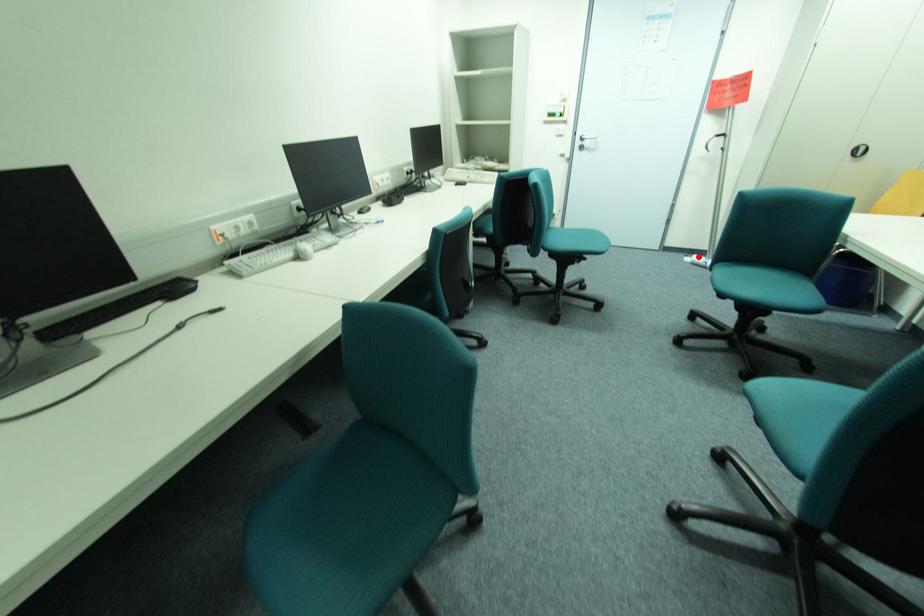
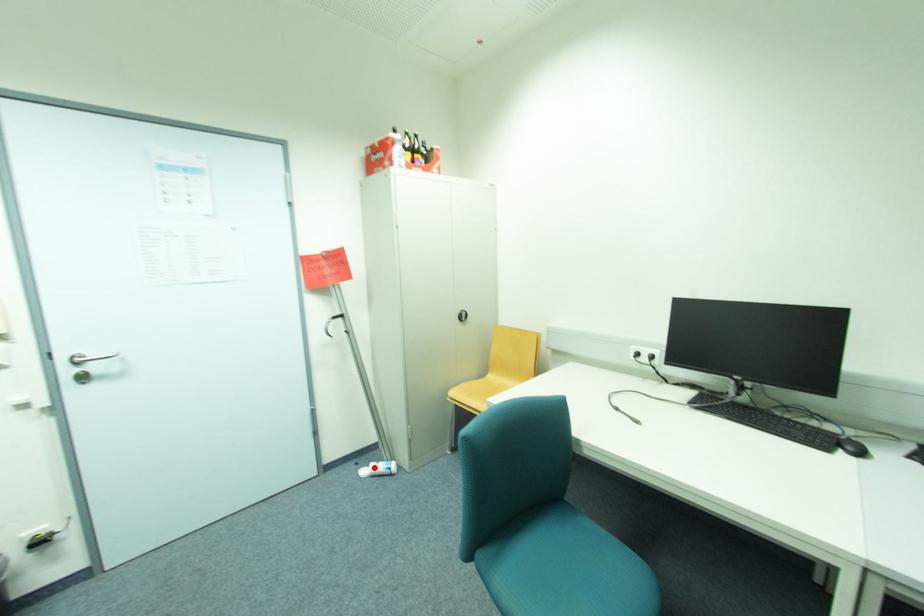
I am providing you with two images of the same scene from different viewpoints. A red point is marked on the first image and another point is marked on the second image. Is the red point in image1 aligned with the point shown in image2?

Yes